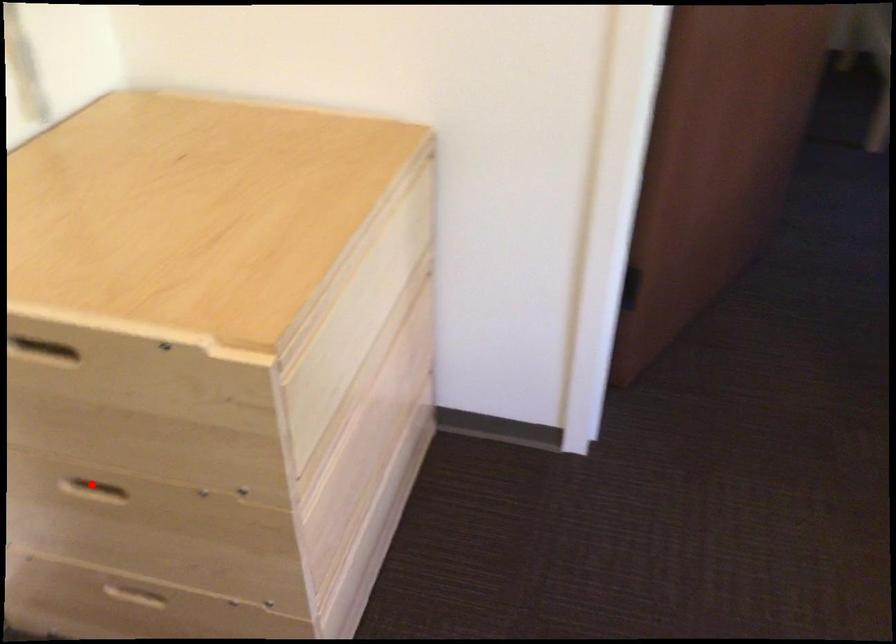
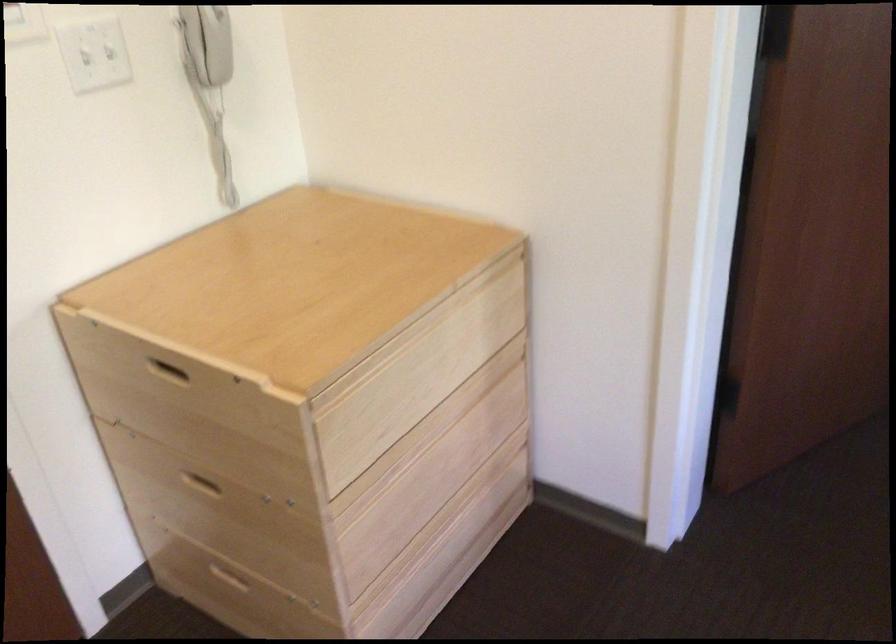
Locate, in the second image, the point that corresponds to the highlighted location in the first image.

(201, 483)